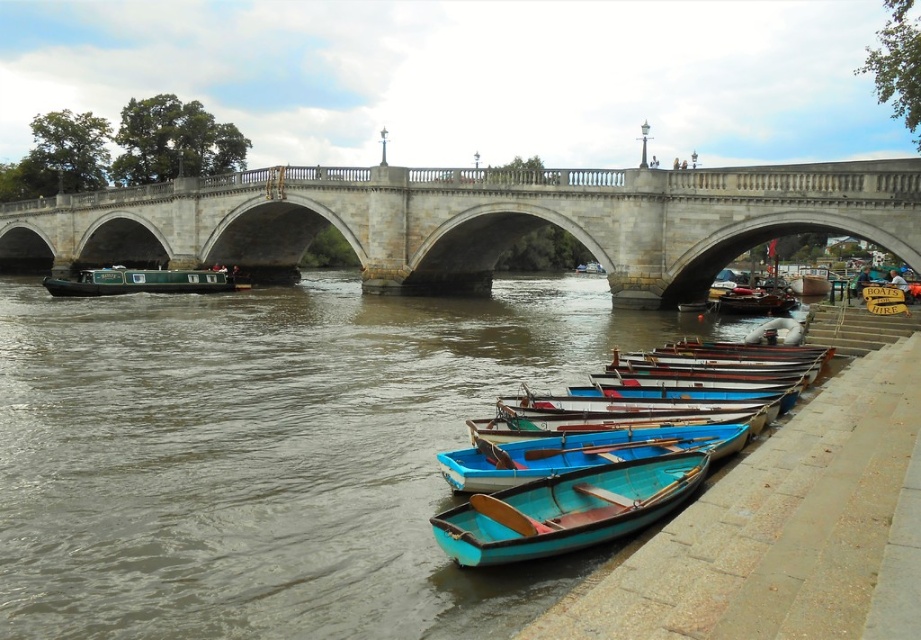
You are standing at the riverside and want to take a photo of both point (845,177) and point (688,435) in the scene. Which point should you focus on first to ensure both are in sharp focus?

You should focus on point (845,177) first because it is closer to the camera than point (688,435). This ensures that both points will be in focus when using the hyperfocal distance technique.

You are standing at the center of the large stone bridge with three arches and want to locate the teal matte canoe at lower right. According to the coordinates provided, in which direction should you look to find it?

The teal matte canoe at lower right is located at coordinates point (567, 509), so you should look towards the lower right direction to find it.

You are standing at the center of the large stone bridge with three arches. Looking down, you notice a point marked at coordinates (x=272, y=456). What is the color and material of the surface at this point?

The point at coordinates (x=272, y=456) corresponds to brown matte water at lower left.